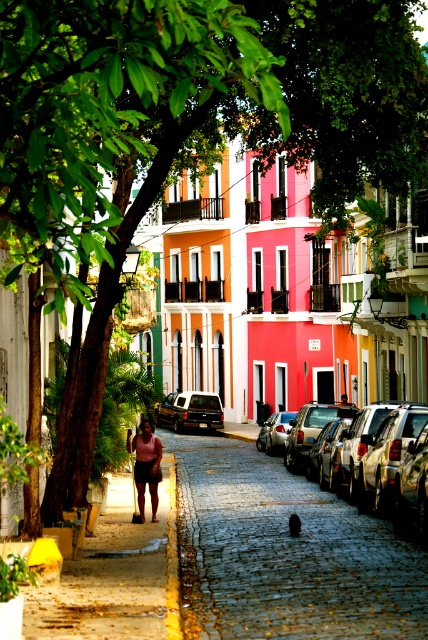
You are a delivery driver who needs to park your shiny silver car at center in a parking spot that can only accommodate cars smaller than the metallic silver car at center. Is your car too big for the spot?

The shiny silver car at center is larger than the metallic silver car at center, so it is too big for the parking spot designed for cars smaller than the metallic silver car at center.

You are a delivery person standing at the edge of the street. You need to deliver a package to the shiny silver car at center and the matte pink skin at center. The delivery robot you are using has a maximum delivery range of 5 meters. Can you deliver both items without moving your position?

The shiny silver car at center and the matte pink skin at center are 4.94 meters apart. Since the delivery robot has a maximum range of 5 meters, both items are within the 5 meter range, so yes, you can deliver both items without moving your position.

You are a delivery person trying to park your shiny silver car at center between two other cars. The space between the metallic silver car at center and another car is 1.8 meters. Can your car fit into that space?

The shiny silver car at center is thinner than the metallic silver car at center. The space between them is 1.8 meters. Since the shiny silver car is thinner, it can fit into the space as long as its width is less than 1.8 meters. However, without knowing the exact width of the shiny silver car, we cannot definitively say if it will fit. Please measure your car first.